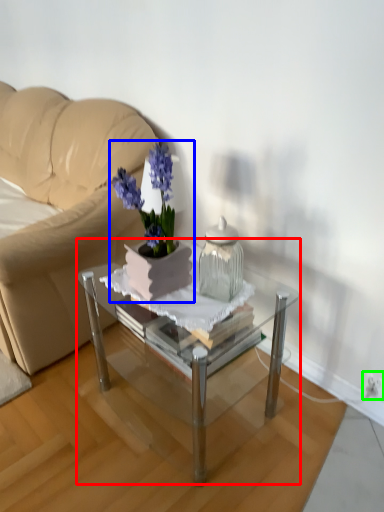
Question: Estimate the real-world distances between objects in this image. Which object is farther from coffee table (highlighted by a red box), houseplant (highlighted by a blue box) or electric outlet (highlighted by a green box)?

Choices:
 (A) houseplant
 (B) electric outlet

Answer: (B)